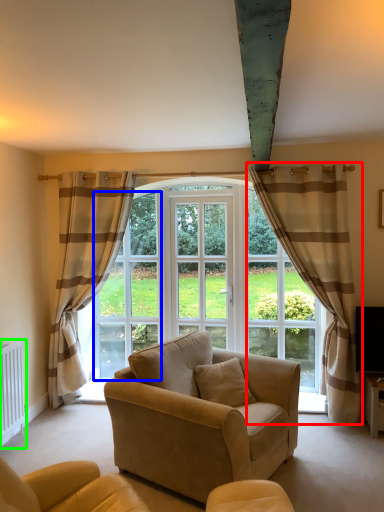
Question: Based on their relative distances, which object is farther from curtain (highlighted by a red box)? Choose from window screen (highlighted by a blue box) and radiator (highlighted by a green box).

Choices:
 (A) window screen
 (B) radiator

Answer: (B)